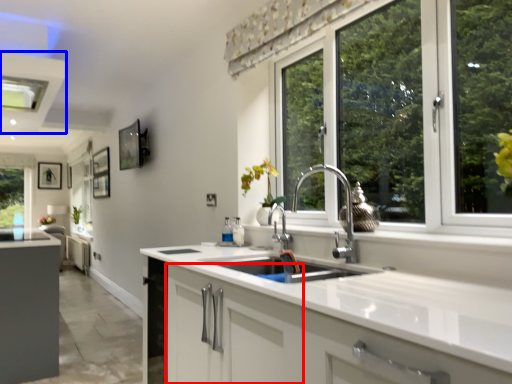
Question: Which object is closer to the camera taking this photo, cabinetry (highlighted by a red box) or exhaust hood (highlighted by a blue box)?

Choices:
 (A) cabinetry
 (B) exhaust hood

Answer: (A)